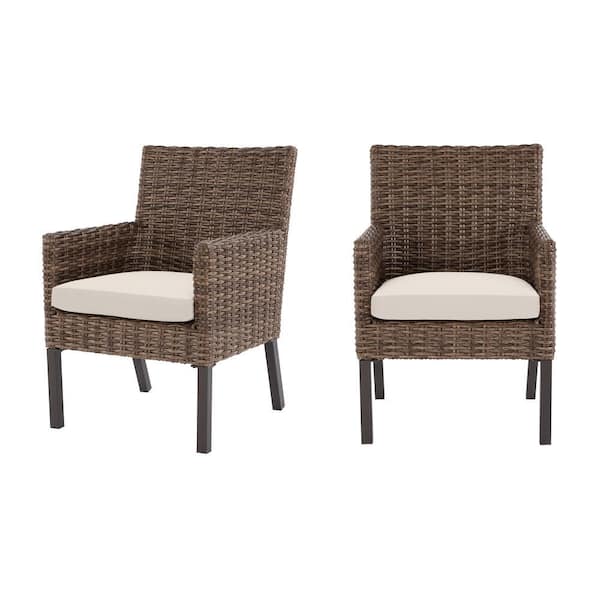
Locate an element on the screen. This screenshot has width=600, height=600. seat back is located at coordinates (502, 174), (185, 186).